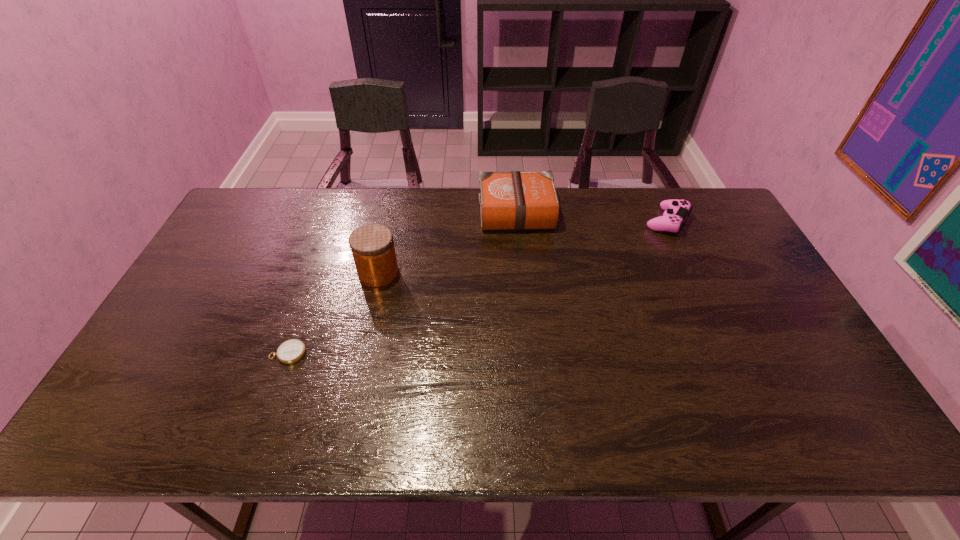
I want to click on free spot located 0.340m on the left of the control, so click(543, 221).

Locate an element on the screen. The height and width of the screenshot is (540, 960). vacant area located 0.100m on the left of the shortest object is located at coordinates (231, 353).

Find the location of a particular element. The height and width of the screenshot is (540, 960). Bible at the far edge is located at coordinates (515, 200).

Identify the location of control present at the far edge. The height and width of the screenshot is (540, 960). (675, 211).

Where is `object present at the right edge`? Image resolution: width=960 pixels, height=540 pixels. object present at the right edge is located at coordinates (675, 211).

What are the coordinates of `object at the far right corner` in the screenshot? It's located at (675, 211).

The width and height of the screenshot is (960, 540). In the image, there is a desktop. Find the location of `blank space at the far edge`. blank space at the far edge is located at coordinates (565, 198).

The height and width of the screenshot is (540, 960). In the image, there is a desktop. In order to click on vacant space at the near edge in this screenshot , I will do `click(785, 430)`.

What are the coordinates of `vacant space at the left edge of the desktop` in the screenshot? It's located at (188, 298).

In order to click on free space at the right edge of the desktop in this screenshot , I will do `click(731, 300)`.